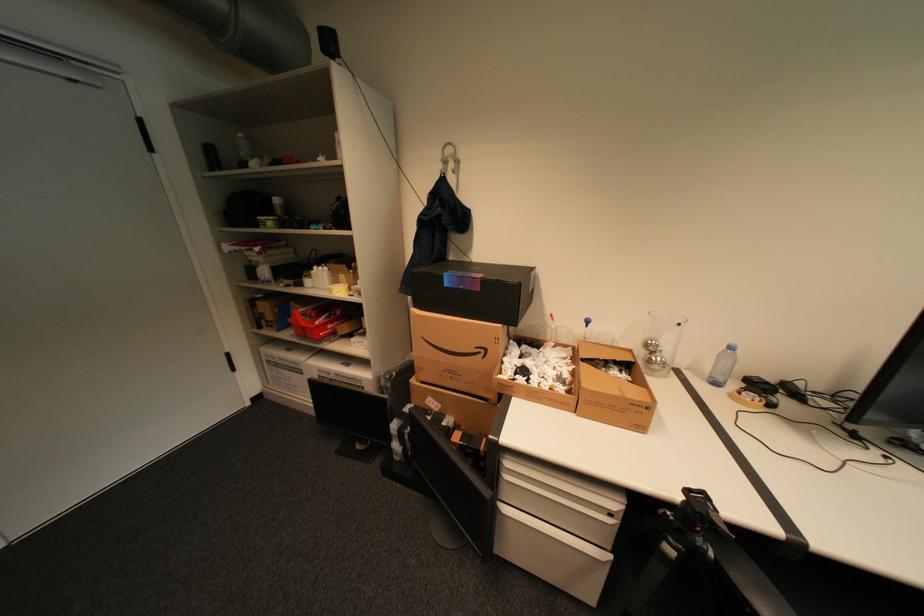
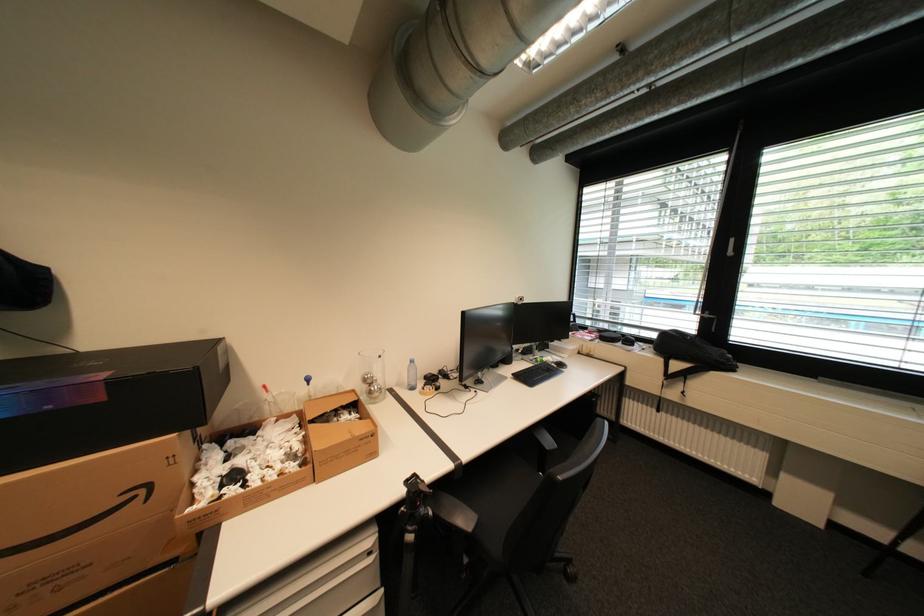
Where in the second image is the point corresponding to (492,352) from the first image?

(151, 491)